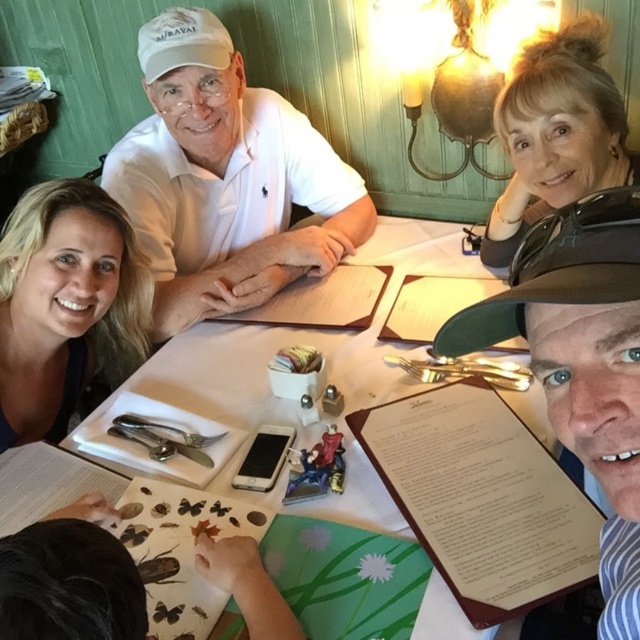
Question: Is white paper placemat at center further to the viewer compared to blonde hair at left?

Choices:
 (A) no
 (B) yes

Answer: (A)

Question: Which point appears farthest from the camera in this image?

Choices:
 (A) (378, 324)
 (B) (593, 352)
 (C) (561, 177)
 (D) (339, 172)

Answer: (D)

Question: Estimate the real-world distances between objects in this image. Which object is closer to the blonde hair at upper right?

Choices:
 (A) white paper placemat at center
 (B) blonde hair at left
 (C) brown leather hat at upper right
 (D) white matte cap at upper center

Answer: (A)

Question: Is white matte cap at upper center further to camera compared to brown leather hat at upper right?

Choices:
 (A) yes
 (B) no

Answer: (A)

Question: Is brown leather hat at upper right further to camera compared to white paper placemat at center?

Choices:
 (A) yes
 (B) no

Answer: (B)

Question: Which object is the farthest from the blonde hair at upper right?

Choices:
 (A) brown leather hat at upper right
 (B) white paper placemat at center
 (C) white paper menu at center

Answer: (A)